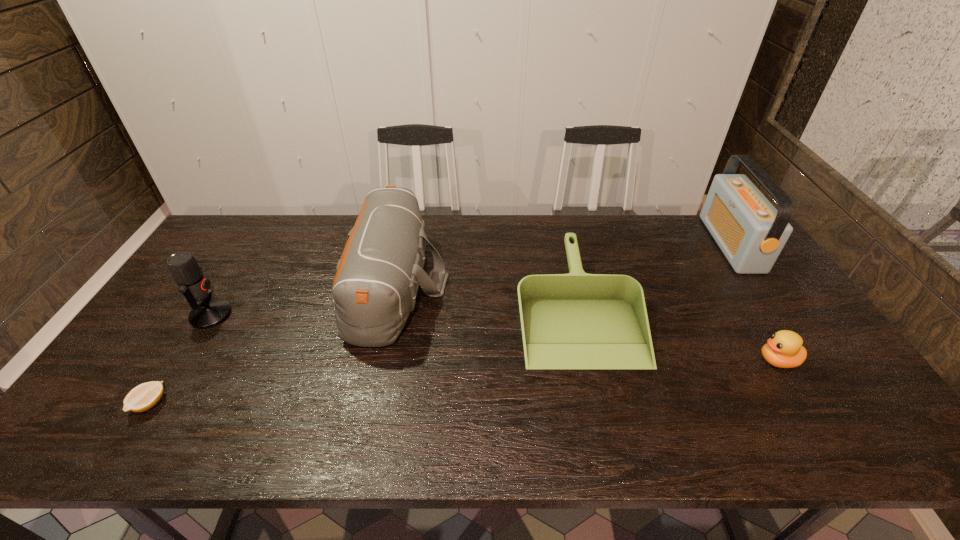
This screenshot has height=540, width=960. In order to click on vacant point located on the right of the duffel bag in this screenshot , I will do `click(522, 284)`.

This screenshot has width=960, height=540. Find the location of `vacant space situated on the side of the microphone with the red ring`. vacant space situated on the side of the microphone with the red ring is located at coordinates (335, 315).

Where is `free space located 0.160m on the scoop of the third object from right to left`? The image size is (960, 540). free space located 0.160m on the scoop of the third object from right to left is located at coordinates (605, 427).

This screenshot has height=540, width=960. In order to click on free spot located 0.370m on the face of the duckling in this screenshot , I will do `click(614, 361)`.

I want to click on free space located on the face of the duckling, so pyautogui.click(x=614, y=361).

Find the location of `blank area located 0.100m on the face of the duckling`. blank area located 0.100m on the face of the duckling is located at coordinates (718, 361).

I want to click on vacant space located 0.070m on the left of the shortest object, so click(x=106, y=404).

The width and height of the screenshot is (960, 540). Identify the location of radio receiver situated at the far edge. (751, 233).

What are the coordinates of `duffel bag that is at the far edge` in the screenshot? It's located at (376, 281).

Locate an element on the screen. This screenshot has height=540, width=960. object that is at the near edge is located at coordinates (144, 396).